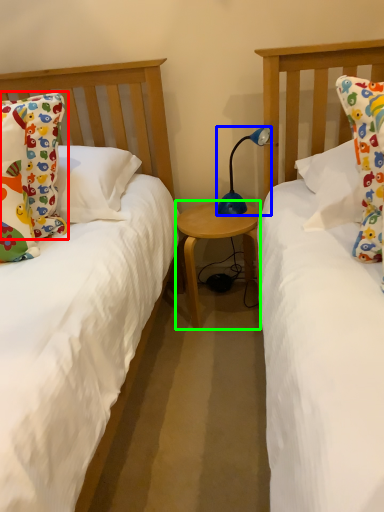
Question: Estimate the real-world distances between objects in this image. Which object is closer to pillow (highlighted by a red box), lamp (highlighted by a blue box) or table (highlighted by a green box)?

Choices:
 (A) lamp
 (B) table

Answer: (B)